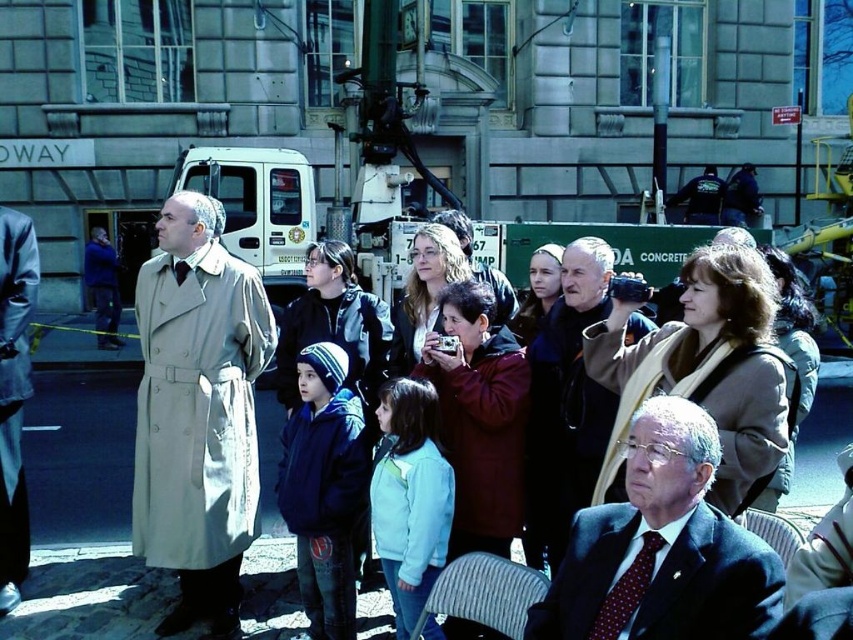
You are standing at the center of the scene and want to locate the beige fabric trench coat at left. According to the coordinates provided, in which direction should you look to find it?

The beige fabric trench coat at left is located at coordinates point (196, 412), which means it is to the right side of the scene from your central position.

In the scene shown: You are a photographer standing near the camera held by the woman in a brown coat. You need to capture a photo of the dark blue suit at lower right without any obstructions. Given that your camera has a maximum zoom range of 3 meters, will you be able to take the photo from your current position?

The dark blue suit at lower right is 4.59 meters from the camera. Since the camera has a maximum zoom range of 3 meters, you cannot capture the photo without obstructions from this distance.